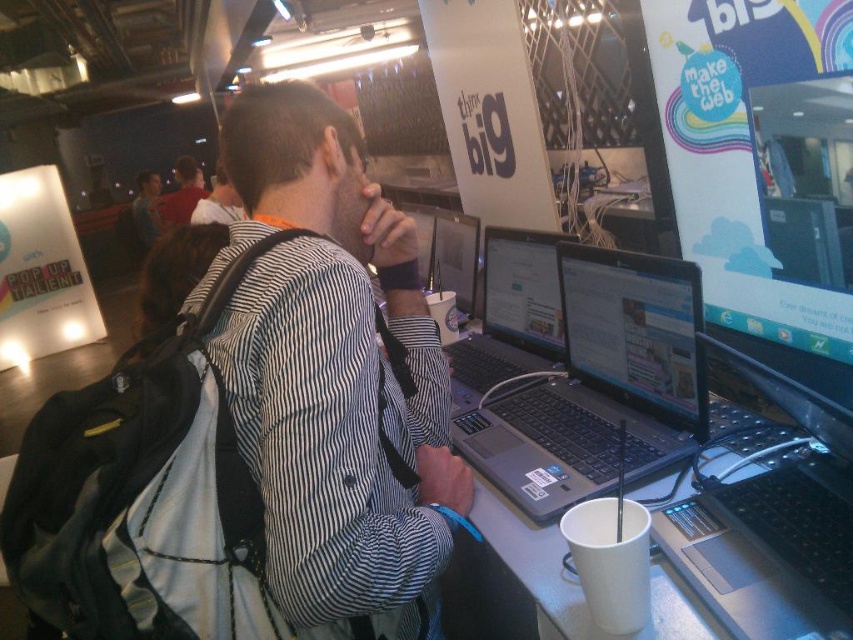
You are standing at the entrance of the event venue and see the scene described. There is a point marked at coordinates (509, 316). What object is located at that point?

The point at coordinates (509, 316) corresponds to the sleek silver laptop at center.

You are organizing a tech event and need to know if the sleek silver laptop at center can fit inside the dark brown leather backpack at upper left. Based on their sizes, can it fit?

The sleek silver laptop at center has a width less than the dark brown leather backpack at upper left, so it can fit inside the backpack.